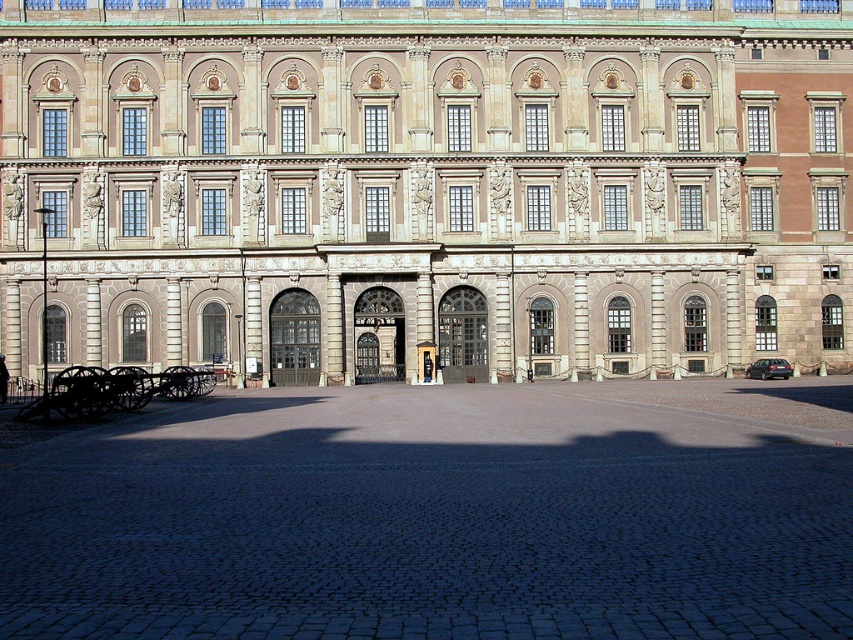
Is beige stone palace at center thinner than black polished cannon at lower left?

No.

Is beige stone palace at center bigger than black polished cannon at lower left?

Yes.

Is point (556, 321) closer to viewer compared to point (199, 394)?

No, (556, 321) is behind (199, 394).

Where is `beige stone palace at center`? This screenshot has width=853, height=640. beige stone palace at center is located at coordinates (426, 186).

Is beige stone palace at center bigger than dark cobblestone courtyard at center?

Indeed, beige stone palace at center has a larger size compared to dark cobblestone courtyard at center.

Who is taller, beige stone palace at center or dark cobblestone courtyard at center?

Standing taller between the two is beige stone palace at center.

Is point (699, 269) closer to camera compared to point (213, 433)?

That is False.

At what (x,y) coordinates should I click in order to perform the action: click on beige stone palace at center. Please return your answer as a coordinate pair (x, y). The image size is (853, 640). Looking at the image, I should click on (426, 186).

Can you confirm if dark cobblestone courtyard at center is taller than black polished cannon at lower left?

No, dark cobblestone courtyard at center is not taller than black polished cannon at lower left.

Looking at this image, between dark cobblestone courtyard at center and black polished cannon at lower left, which one appears on the right side from the viewer's perspective?

From the viewer's perspective, dark cobblestone courtyard at center appears more on the right side.

Between point (357, 401) and point (132, 380), which one is positioned in front?

Point (132, 380)

Identify the location of dark cobblestone courtyard at center. Image resolution: width=853 pixels, height=640 pixels. (444, 515).